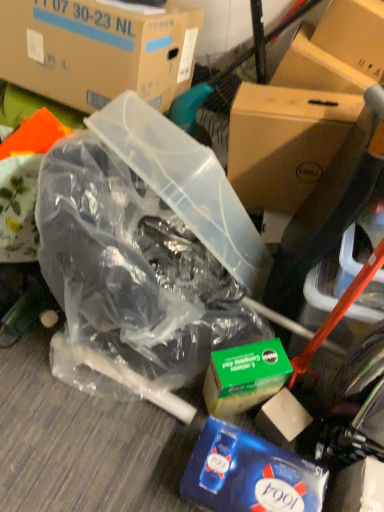
Question: From a real-world perspective, is transparent plastic bag at center positioned above or below cardboard box at upper left, marked as the second box in a right-to-left arrangement?

Choices:
 (A) above
 (B) below

Answer: (B)

Question: Considering the positions of point (145, 254) and point (170, 23), is point (145, 254) closer or farther from the camera than point (170, 23)?

Choices:
 (A) farther
 (B) closer

Answer: (A)

Question: Estimate the real-world distances between objects in this image. Which object is closer to the brown cardboard box at upper right, the first box positioned from the right?

Choices:
 (A) blue glossy tissue box at lower right
 (B) transparent plastic bag at center
 (C) cardboard box at upper left, which is the first box in left-to-right order
 (D) green cardboard box at center

Answer: (C)

Question: Estimate the real-world distances between objects in this image. Which object is closer to the brown cardboard box at upper right, the first box positioned from the right?

Choices:
 (A) transparent plastic bag at center
 (B) blue glossy tissue box at lower right
 (C) cardboard box at upper left, marked as the second box in a right-to-left arrangement
 (D) green cardboard box at center

Answer: (C)